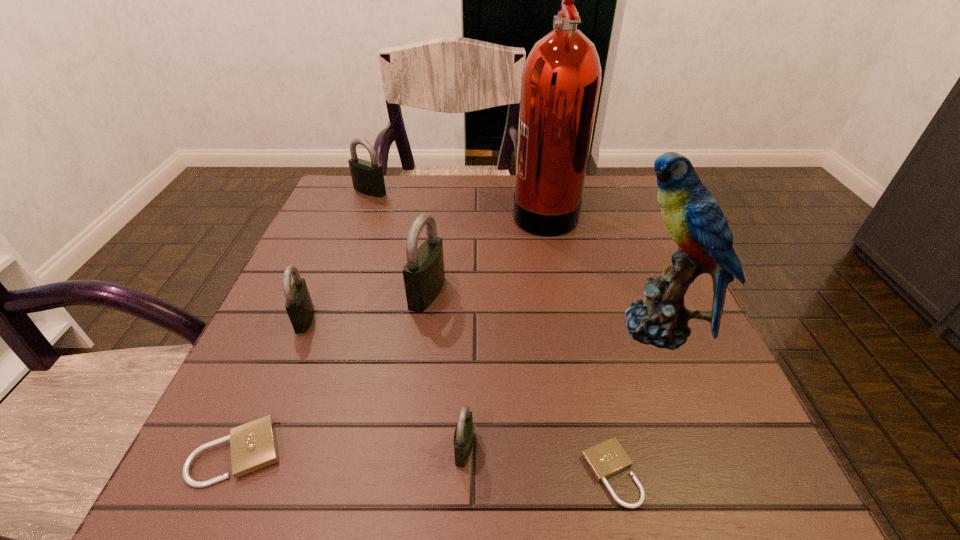
Where is `the tallest object`? the tallest object is located at coordinates (561, 78).

Where is `fire extinguisher`? This screenshot has width=960, height=540. fire extinguisher is located at coordinates (561, 78).

This screenshot has width=960, height=540. What are the coordinates of `the second tallest object` in the screenshot? It's located at (694, 220).

Identify the location of parrot. (694, 220).

Where is `the third black padlock from left to right`? This screenshot has width=960, height=540. the third black padlock from left to right is located at coordinates (424, 275).

Locate an element on the screen. This screenshot has width=960, height=540. the biggest black padlock is located at coordinates (424, 275).

You are a GUI agent. You are given a task and a screenshot of the screen. Output one action in this format:
    pyautogui.click(x=<x>, y=<y>)
    Task: Click on the fifth shortest padlock
    This screenshot has width=960, height=540.
    Given the screenshot: What is the action you would take?
    pyautogui.click(x=367, y=177)

The image size is (960, 540). Find the location of `the fifth shortest object`. the fifth shortest object is located at coordinates (367, 177).

Where is `the third biggest black padlock`? This screenshot has height=540, width=960. the third biggest black padlock is located at coordinates (299, 306).

Find the location of `the fifth tallest object`. the fifth tallest object is located at coordinates click(x=299, y=306).